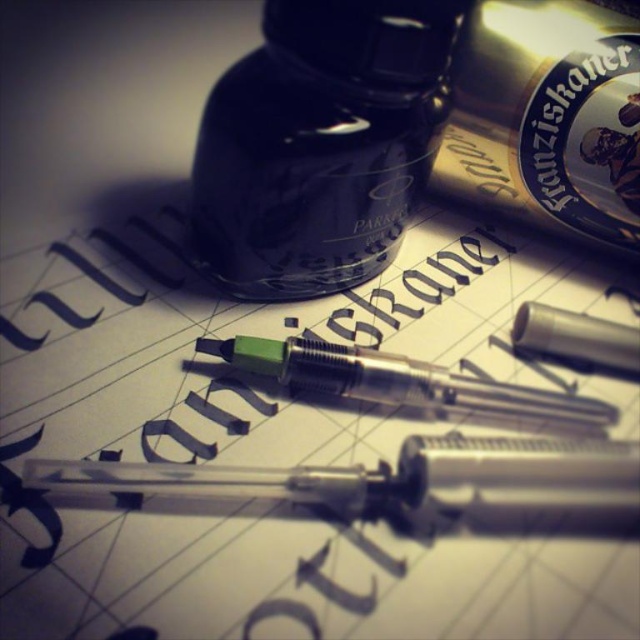
You are an artist trying to place a new calligraphy tool on the setup. The tool is 10 cm tall. Given the current arrangement, can the matte paper at center accommodate the height of the green plastic pen at center and the new tool without overlapping?

The matte paper at center has a greater height compared to the green plastic pen at center. Since the paper is taller than the pen, the new tool at 10 cm can be placed without overlapping as long as its height does not exceed the paper.

You are an artist trying to place a new element in the scene. The scene has a matte paper at center. Where exactly should you position it to match the existing composition?

The matte paper at center should be positioned at point (278, 445) to align with the existing composition.